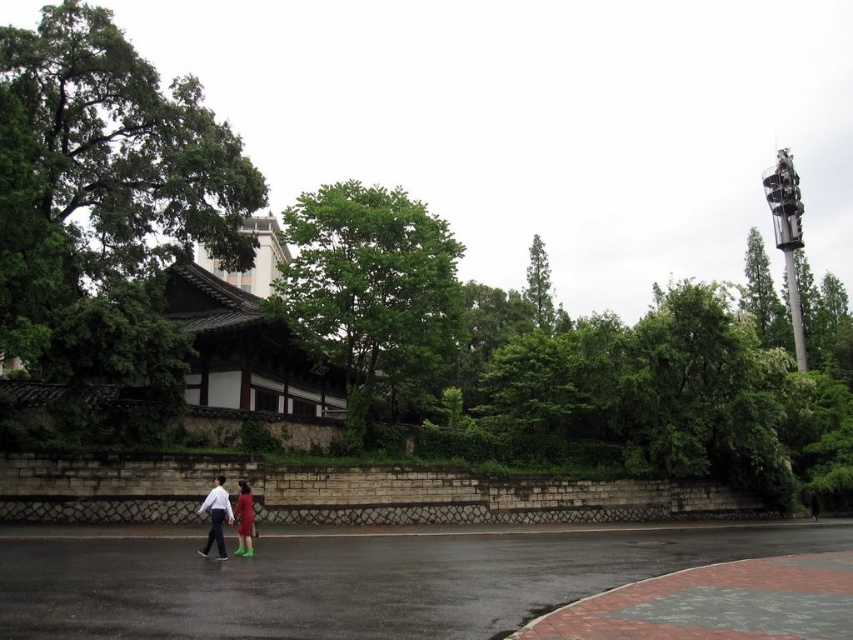
Looking at this image, you are standing in the outdoor scene and notice two green leafy trees. Which tree, the green leafy tree at upper left or the green leafy tree at center, is closer to you?

The green leafy tree at upper left is closer to you because it is in front of the green leafy tree at center.

You are standing in front of the traditional building and notice the green leafy tree at upper left and the matte green boots at lower center. Which object is taller?

The green leafy tree at upper left is taller than the matte green boots at lower center.

You are a photographer trying to capture the green leafy tree at upper left and the matte green boots at lower center in a single frame. Which object should you focus on first if you want to ensure both are in the frame without moving the camera?

You should focus on the green leafy tree at upper left first because it is wider than the matte green boots at lower center, so centering it will help include both in the frame.